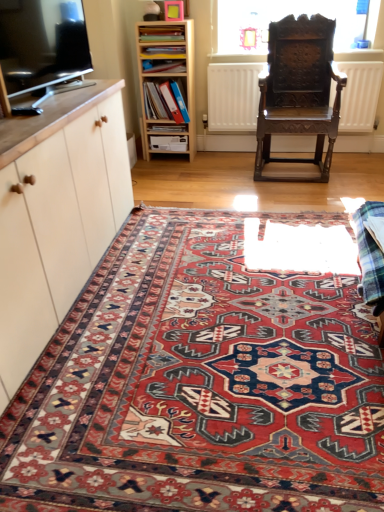
Question: Considering the relative sizes of matte white cabinet at left and carpet with intricate patterns at center in the image provided, is matte white cabinet at left wider than carpet with intricate patterns at center?

Choices:
 (A) no
 (B) yes

Answer: (A)

Question: From the image's perspective, would you say matte white cabinet at left is shown under carpet with intricate patterns at center?

Choices:
 (A) no
 (B) yes

Answer: (A)

Question: Considering the relative sizes of matte white cabinet at left and carpet with intricate patterns at center in the image provided, is matte white cabinet at left thinner than carpet with intricate patterns at center?

Choices:
 (A) yes
 (B) no

Answer: (A)

Question: Is matte white cabinet at left facing away from carpet with intricate patterns at center?

Choices:
 (A) no
 (B) yes

Answer: (A)

Question: Can you confirm if matte white cabinet at left is positioned to the left of carpet with intricate patterns at center?

Choices:
 (A) yes
 (B) no

Answer: (A)

Question: From the image's perspective, is matte white cabinet at left on carpet with intricate patterns at center?

Choices:
 (A) yes
 (B) no

Answer: (A)

Question: Considering the relative sizes of black glossy tv at upper left and matte wooden bookshelf at upper center, the fourth book when ordered from bottom to top, in the image provided, is black glossy tv at upper left wider than matte wooden bookshelf at upper center, the fourth book when ordered from bottom to top,?

Choices:
 (A) yes
 (B) no

Answer: (B)

Question: Is black glossy tv at upper left aimed at matte wooden bookshelf at upper center, the fourth book when ordered from bottom to top?

Choices:
 (A) yes
 (B) no

Answer: (B)

Question: Can you confirm if black glossy tv at upper left is shorter than matte wooden bookshelf at upper center, which appears as the first book when viewed from the top?

Choices:
 (A) yes
 (B) no

Answer: (B)

Question: From a real-world perspective, is black glossy tv at upper left physically below matte wooden bookshelf at upper center, the fourth book when ordered from bottom to top?

Choices:
 (A) yes
 (B) no

Answer: (B)

Question: Are black glossy tv at upper left and matte wooden bookshelf at upper center, the fourth book when ordered from bottom to top, far apart?

Choices:
 (A) yes
 (B) no

Answer: (A)

Question: Is black glossy tv at upper left to the right of matte wooden bookshelf at upper center, the fourth book when ordered from bottom to top, from the viewer's perspective?

Choices:
 (A) no
 (B) yes

Answer: (A)

Question: Is matte cardboard book at center, positioned as the 1th book in bottom-to-top order, taller than matte blue book at upper center, acting as the 3th book starting from the top?

Choices:
 (A) no
 (B) yes

Answer: (A)